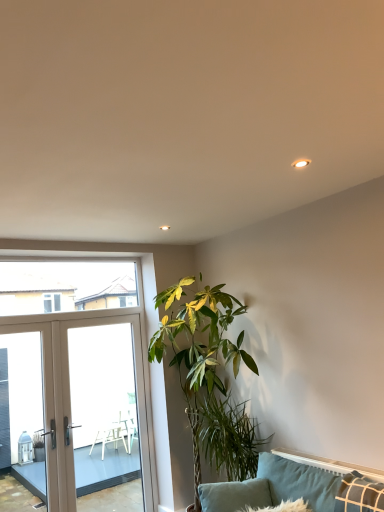
Question: Is green leafy plant at center in contact with white glossy screen door at left?

Choices:
 (A) no
 (B) yes

Answer: (A)

Question: Is green leafy plant at center completely or partially outside of white glossy screen door at left?

Choices:
 (A) yes
 (B) no

Answer: (A)

Question: From a real-world perspective, is green leafy plant at center positioned under white glossy screen door at left based on gravity?

Choices:
 (A) no
 (B) yes

Answer: (A)

Question: Is green leafy plant at center further to the viewer compared to white glossy screen door at left?

Choices:
 (A) yes
 (B) no

Answer: (B)

Question: Can you confirm if green leafy plant at center is wider than white glossy screen door at left?

Choices:
 (A) no
 (B) yes

Answer: (B)

Question: Is green leafy plant at center in front of white glossy screen door at left?

Choices:
 (A) no
 (B) yes

Answer: (B)

Question: Considering the relative positions of transparent glass window at upper left and beige glass door at left in the image provided, is transparent glass window at upper left to the right of beige glass door at left from the viewer's perspective?

Choices:
 (A) no
 (B) yes

Answer: (A)

Question: Is transparent glass window at upper left positioned far away from beige glass door at left?

Choices:
 (A) no
 (B) yes

Answer: (A)

Question: Can you confirm if transparent glass window at upper left is taller than beige glass door at left?

Choices:
 (A) no
 (B) yes

Answer: (A)

Question: Can you confirm if transparent glass window at upper left is positioned to the left of beige glass door at left?

Choices:
 (A) no
 (B) yes

Answer: (B)

Question: From the image's perspective, is transparent glass window at upper left on top of beige glass door at left?

Choices:
 (A) no
 (B) yes

Answer: (B)

Question: Does transparent glass window at upper left have a larger size compared to beige glass door at left?

Choices:
 (A) no
 (B) yes

Answer: (A)

Question: From the image's perspective, is velvet teal pillow at lower right on beige glass door at left?

Choices:
 (A) no
 (B) yes

Answer: (A)